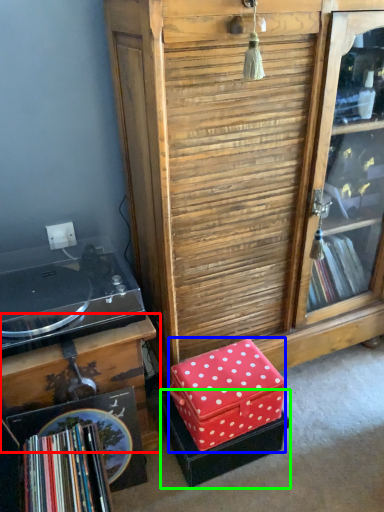
Question: Based on their relative distances, which object is nearer to table (highlighted by a red box)? Choose from storage box (highlighted by a blue box) and storage box (highlighted by a green box).

Choices:
 (A) storage box
 (B) storage box

Answer: (A)